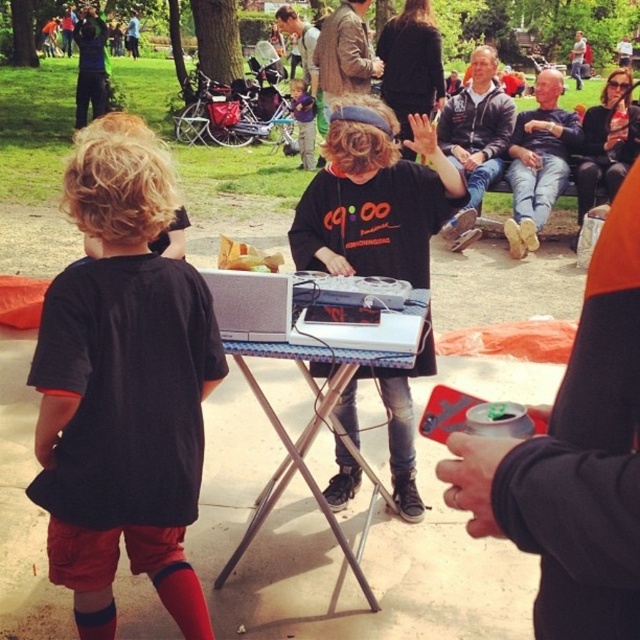
Which is behind, point (372, 250) or point (456, 240)?

The point (456, 240) is more distant.

Who is higher up, black matte shirt at center or dark gray hoodie at center?

dark gray hoodie at center is higher up.

What do you see at coordinates (374, 196) in the screenshot?
I see `black matte shirt at center` at bounding box center [374, 196].

You are a GUI agent. You are given a task and a screenshot of the screen. Output one action in this format:
    pyautogui.click(x=<x>, y=<y>)
    Task: Click on the black matte shirt at center
    This screenshot has width=640, height=640.
    Given the screenshot: What is the action you would take?
    pyautogui.click(x=374, y=196)

Is the position of dark gray hoodie at center more distant than that of denim jeans at center?

No, it is not.

Where is `dark gray hoodie at center`? The width and height of the screenshot is (640, 640). dark gray hoodie at center is located at coordinates (476, 140).

Between black matte shirt at center and brown leather jacket at upper center, which one has less height?

Standing shorter between the two is brown leather jacket at upper center.

Which of these two, black matte shirt at center or brown leather jacket at upper center, stands taller?

With more height is black matte shirt at center.

Describe the element at coordinates (374, 196) in the screenshot. I see `black matte shirt at center` at that location.

Where is `black matte shirt at center`? black matte shirt at center is located at coordinates (374, 196).